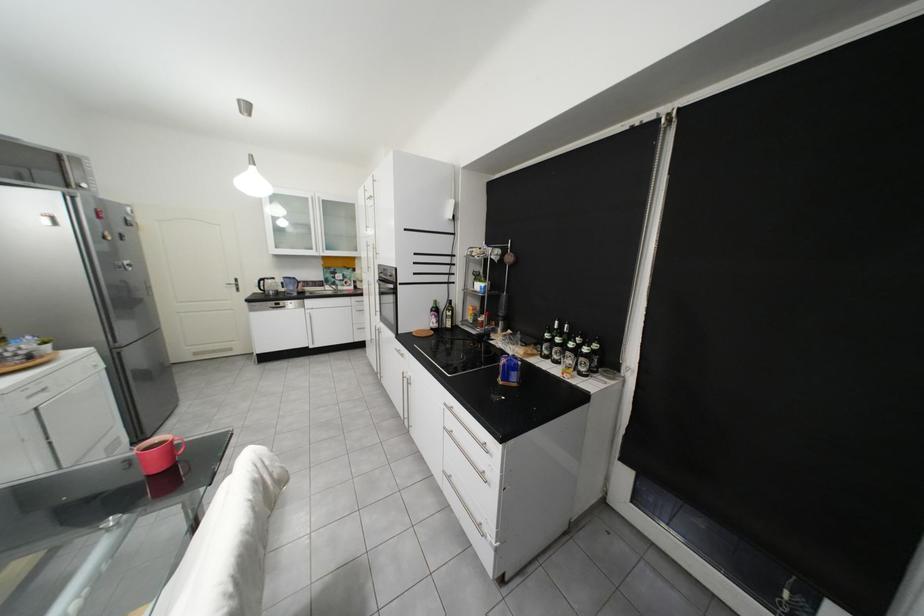
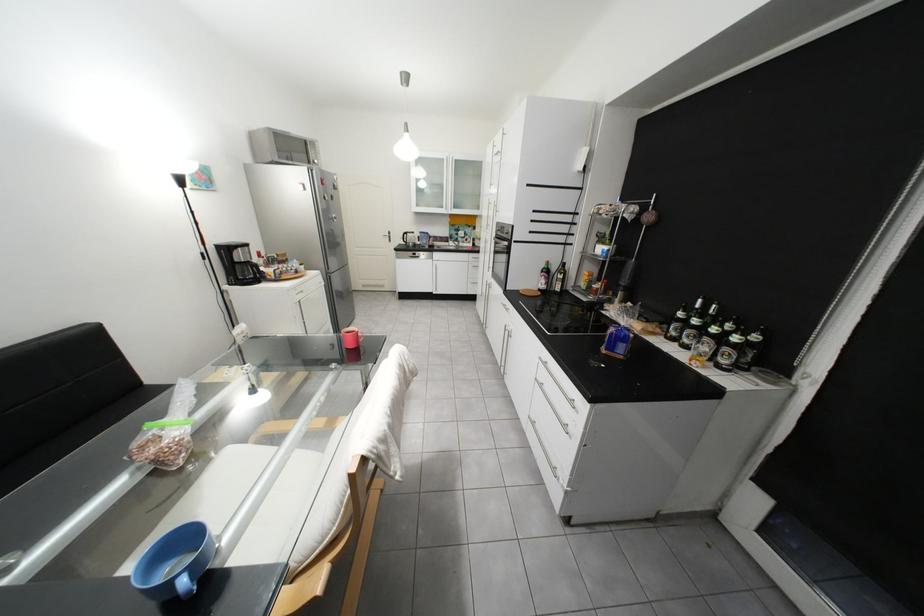
Where in the second image is the point corresponding to (x=482, y=322) from the first image?

(596, 288)